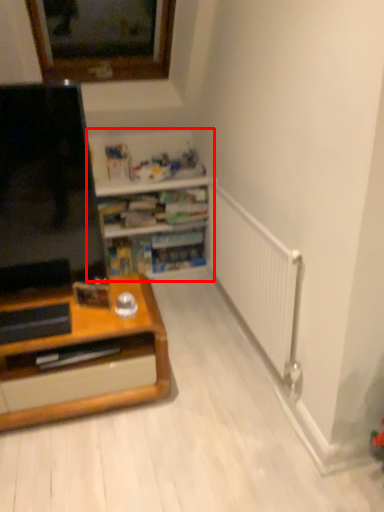
Question: In this image, where is shelf (annotated by the red box) located relative to screen?

Choices:
 (A) left
 (B) right

Answer: (B)